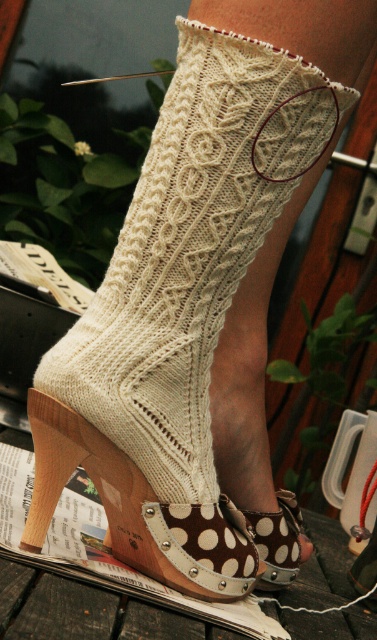
Question: Which object is positioned farthest from the brown polka dot fabric shoe at lower center?

Choices:
 (A) brown polka dot fabric sandal at lower center
 (B) white knitted sock at center

Answer: (B)

Question: Does brown polka dot fabric sandal at lower center appear under brown polka dot fabric shoe at lower center?

Choices:
 (A) yes
 (B) no

Answer: (B)

Question: Among these points, which one is farthest from the camera?

Choices:
 (A) (56, 493)
 (B) (289, 496)

Answer: (B)

Question: Can you confirm if white knitted sock at center is bigger than brown polka dot fabric sandal at lower center?

Choices:
 (A) no
 (B) yes

Answer: (B)

Question: Does brown polka dot fabric sandal at lower center appear on the right side of brown polka dot fabric shoe at lower center?

Choices:
 (A) no
 (B) yes

Answer: (A)

Question: Which object is closer to the camera taking this photo?

Choices:
 (A) brown polka dot fabric shoe at lower center
 (B) brown polka dot fabric sandal at lower center

Answer: (B)